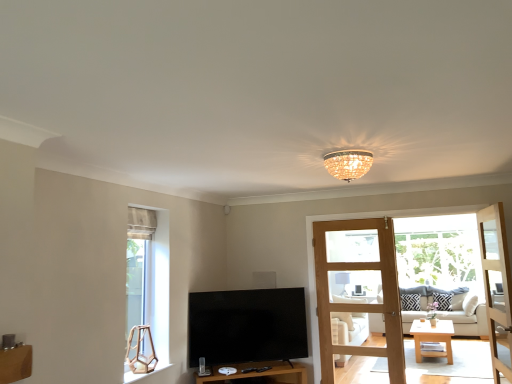
Question: Considering the relative positions of matte black speaker at center and white fabric studio couch at center in the image provided, is matte black speaker at center behind white fabric studio couch at center?

Choices:
 (A) yes
 (B) no

Answer: (B)

Question: From the image's perspective, is matte black speaker at center over white fabric studio couch at center?

Choices:
 (A) yes
 (B) no

Answer: (A)

Question: Is matte black speaker at center oriented towards white fabric studio couch at center?

Choices:
 (A) no
 (B) yes

Answer: (A)

Question: From a real-world perspective, is matte black speaker at center on top of white fabric studio couch at center?

Choices:
 (A) no
 (B) yes

Answer: (B)

Question: Would you say matte black speaker at center contains white fabric studio couch at center?

Choices:
 (A) yes
 (B) no

Answer: (B)

Question: In the image, is white wood coffee table at center positioned in front of or behind black and white zigzag pillow at center, placed as the 2th pillow when sorted from left to right?

Choices:
 (A) behind
 (B) front

Answer: (B)

Question: Is white wood coffee table at center inside or outside of black and white zigzag pillow at center, placed as the 2th pillow when sorted from left to right?

Choices:
 (A) inside
 (B) outside

Answer: (B)

Question: Considering the positions of point (416, 354) and point (449, 306), is point (416, 354) closer or farther from the camera than point (449, 306)?

Choices:
 (A) farther
 (B) closer

Answer: (B)

Question: From the image's perspective, relative to black and white zigzag pillow at center, placed as the 2th pillow when sorted from left to right, is white wood coffee table at center above or below?

Choices:
 (A) below
 (B) above

Answer: (A)

Question: Looking at their shapes, would you say beige fabric window at left is wider or thinner than white wood coffee table at center?

Choices:
 (A) thin
 (B) wide

Answer: (A)

Question: Based on their sizes in the image, would you say beige fabric window at left is bigger or smaller than white wood coffee table at center?

Choices:
 (A) big
 (B) small

Answer: (B)

Question: From the image's perspective, is beige fabric window at left located above or below white wood coffee table at center?

Choices:
 (A) above
 (B) below

Answer: (A)

Question: In the image, is beige fabric window at left on the left side or the right side of white wood coffee table at center?

Choices:
 (A) left
 (B) right

Answer: (A)

Question: From their relative heights in the image, would you say white wood coffee table at center is taller or shorter than white fabric studio couch at center?

Choices:
 (A) short
 (B) tall

Answer: (A)

Question: Does point 430,327 appear closer or farther from the camera than point 477,334?

Choices:
 (A) farther
 (B) closer

Answer: (A)